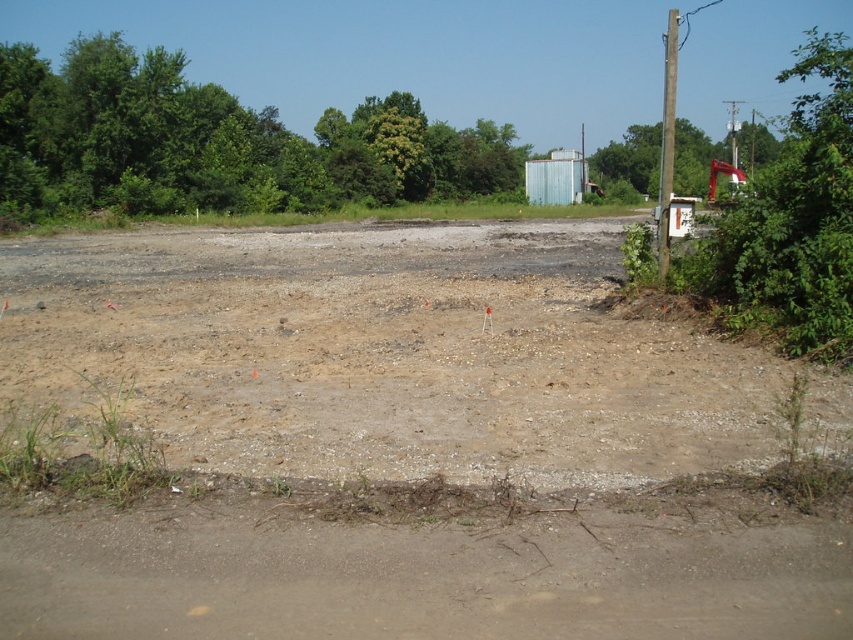
Between dull brown dirt track at lower left and green leafy tree at right, which one is positioned higher?

Positioned higher is green leafy tree at right.

Can you confirm if dull brown dirt track at lower left is taller than green leafy tree at right?

Incorrect, dull brown dirt track at lower left's height is not larger of green leafy tree at right's.

Who is more forward, (695, 545) or (814, 145)?

Point (695, 545) is in front.

Find the location of a particular element. dull brown dirt track at lower left is located at coordinates (426, 573).

Does brown gravel dirt field at center appear on the left side of dull brown dirt track at lower left?

Correct, you'll find brown gravel dirt field at center to the left of dull brown dirt track at lower left.

Between point (509, 291) and point (816, 593), which one is positioned behind?

The point (509, 291) is behind.

Where is `brown gravel dirt field at center`? brown gravel dirt field at center is located at coordinates (383, 353).

Is the position of brown gravel dirt field at center more distant than that of green leafy tree at upper right?

That is False.

Between brown gravel dirt field at center and green leafy tree at upper right, which one is positioned lower?

brown gravel dirt field at center

Is point (473, 250) farther from viewer compared to point (769, 147)?

No, (473, 250) is in front of (769, 147).

Where is `brown gravel dirt field at center`? The image size is (853, 640). brown gravel dirt field at center is located at coordinates (383, 353).